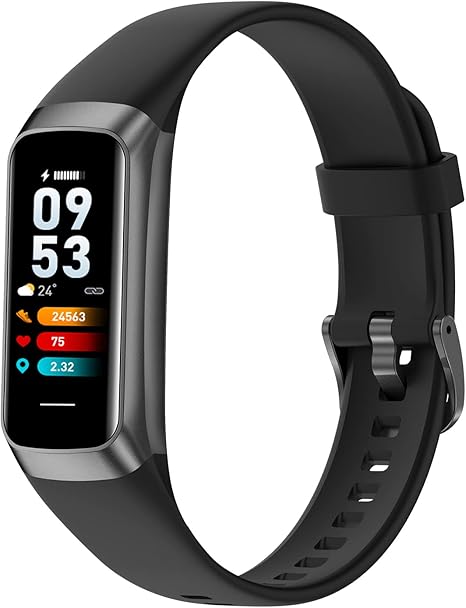
Identify the location of latch. (433, 363).